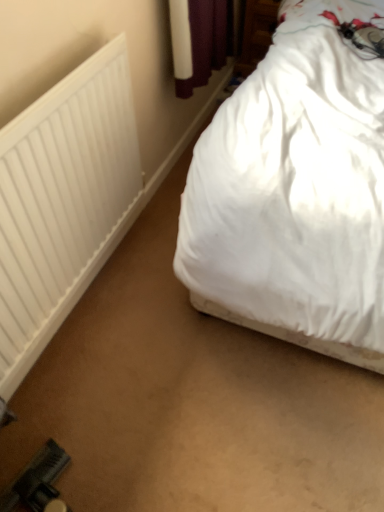
Locate an element on the screen. free region under white matte radiator at left (from a real-world perspective) is located at coordinates (88, 297).